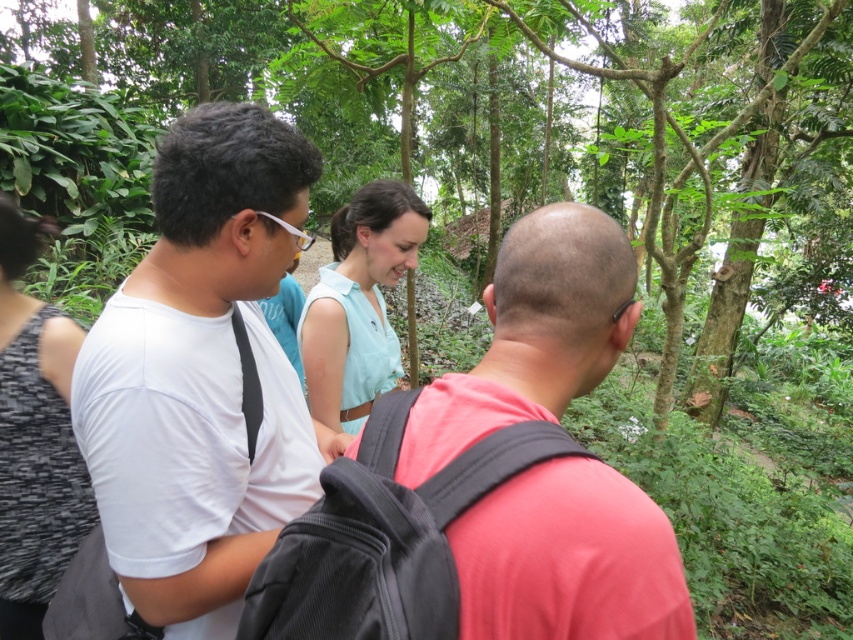
Does white matte shirt at center appear under pink matte shirt at center?

No.

Find the location of a particular element. The height and width of the screenshot is (640, 853). white matte shirt at center is located at coordinates (201, 376).

Locate an element on the screen. The width and height of the screenshot is (853, 640). white matte shirt at center is located at coordinates (201, 376).

Is green leafy tree at center to the left of white matte shirt at center from the viewer's perspective?

No, green leafy tree at center is not to the left of white matte shirt at center.

Which is behind, point (129, 211) or point (102, 516)?

Positioned behind is point (129, 211).

Which is behind, point (155, 35) or point (287, 221)?

Positioned behind is point (155, 35).

The width and height of the screenshot is (853, 640). In order to click on green leafy tree at center in this screenshot , I will do `click(469, 120)`.

Is green leafy tree at center taller than pink matte shirt at center?

Indeed, green leafy tree at center has a greater height compared to pink matte shirt at center.

Is green leafy tree at center in front of pink matte shirt at center?

That is False.

What do you see at coordinates (469, 120) in the screenshot? I see `green leafy tree at center` at bounding box center [469, 120].

Locate an element on the screen. green leafy tree at center is located at coordinates (469, 120).